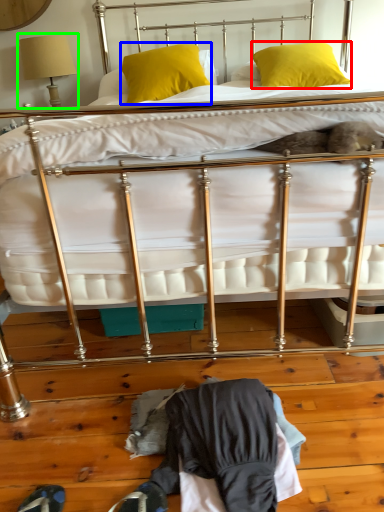
Question: Which object is positioned closest to pillow (highlighted by a red box)? Select from pillow (highlighted by a blue box) and table lamp (highlighted by a green box).

Choices:
 (A) pillow
 (B) table lamp

Answer: (A)